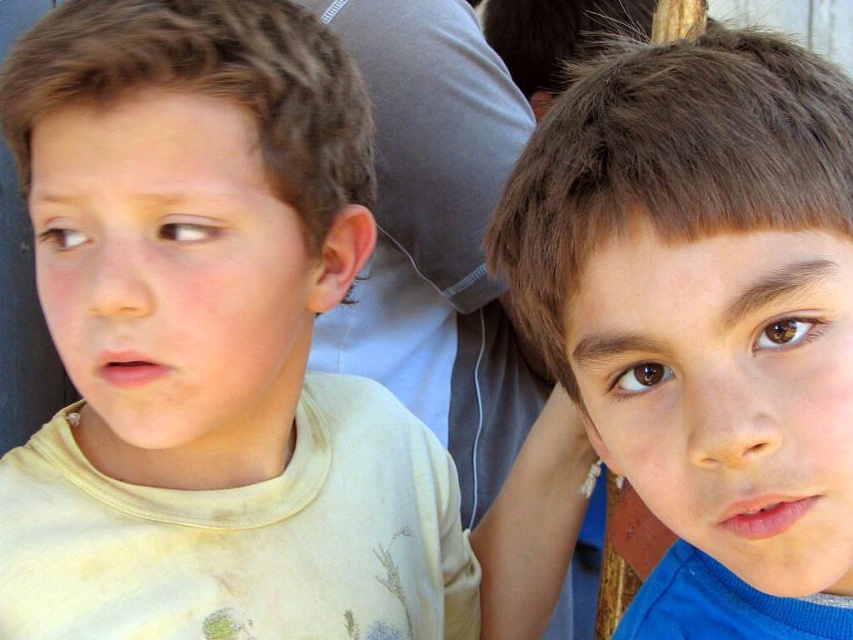
Question: Is brown hair at upper right closer to the viewer compared to yellow cotton shirt at left?

Choices:
 (A) no
 (B) yes

Answer: (B)

Question: Can you confirm if brown hair at upper right is positioned above yellow cotton shirt at left?

Choices:
 (A) yes
 (B) no

Answer: (B)

Question: Which of the following is the farthest from the observer?

Choices:
 (A) (367, 282)
 (B) (695, 317)

Answer: (A)

Question: Can you confirm if brown hair at upper right is smaller than yellow cotton shirt at left?

Choices:
 (A) no
 (B) yes

Answer: (B)

Question: Which object appears farthest from the camera in this image?

Choices:
 (A) yellow cotton shirt at left
 (B) brown hair at upper right

Answer: (A)

Question: Which object appears closest to the camera in this image?

Choices:
 (A) brown hair at upper right
 (B) yellow cotton shirt at left

Answer: (A)